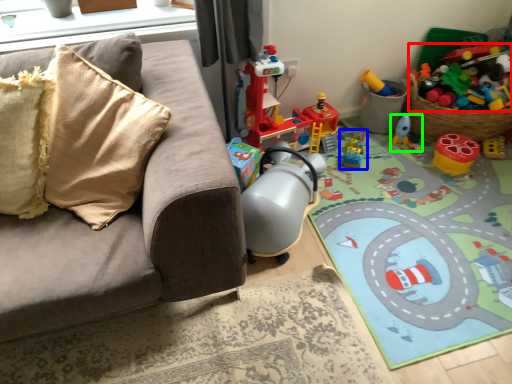
Question: Based on their relative distances, which object is farther from toy (highlighted by a red box)? Choose from toy (highlighted by a blue box) and toy (highlighted by a green box).

Choices:
 (A) toy
 (B) toy

Answer: (A)